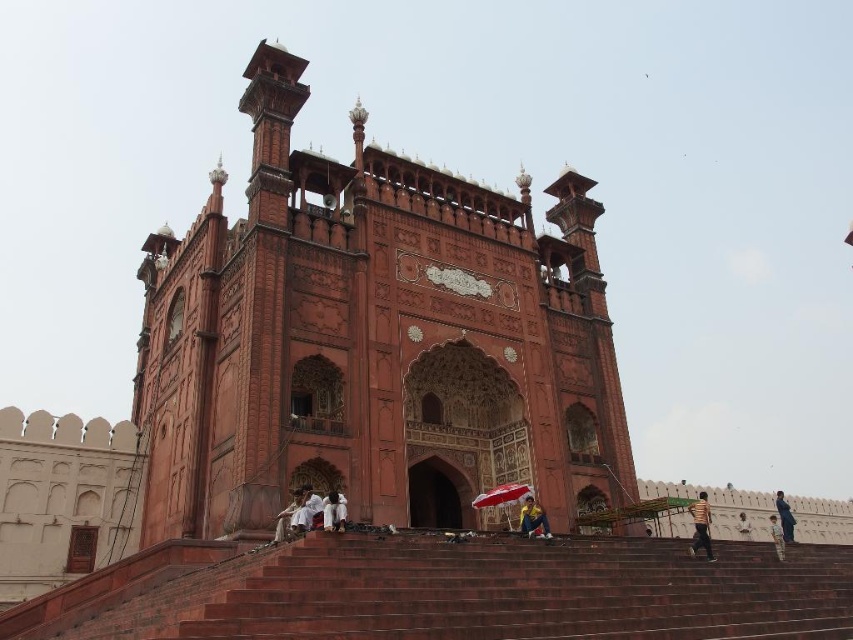
You are standing in front of the mosque and want to take a photo that includes both the red sandstone palace at center and the blue fabric umbrella at center. Based on their positions, which object should you position closer to the left side of your camera frame?

The red sandstone palace at center is to the left of blue fabric umbrella at center, so you should position the red sandstone palace at center closer to the left side of your camera frame.

You are standing in front of the grand mosque described in the scene. You notice the red sandstone palace at center and the blue fabric umbrella at center. Which object do you think occupies more horizontal space from left to right?

The red sandstone palace at center might be wider than blue fabric umbrella at center, so it likely occupies more horizontal space from left to right.